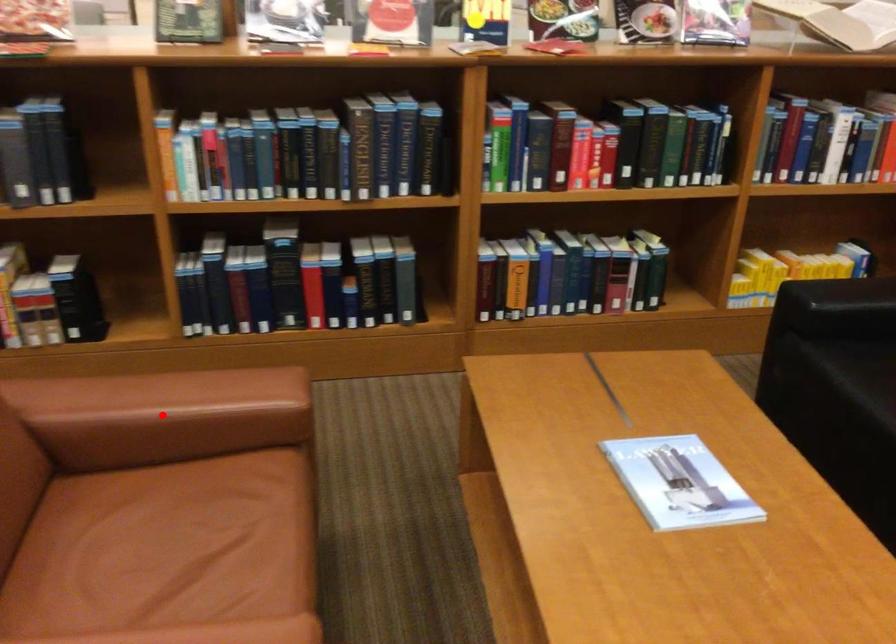
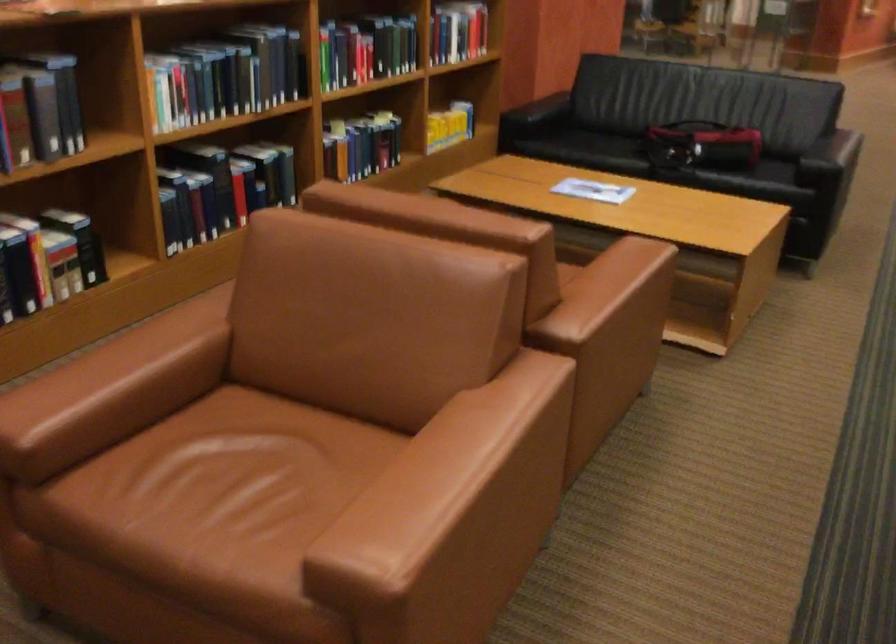
Question: I am providing you with two images of the same scene from different viewpoints. A red point is marked on the first image. Can you still see the location of the red point in image 2?

Choices:
 (A) Yes
 (B) No

Answer: (B)